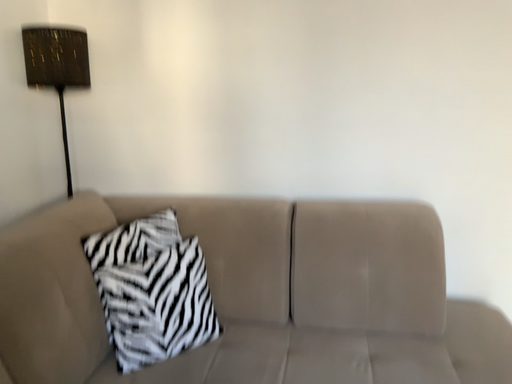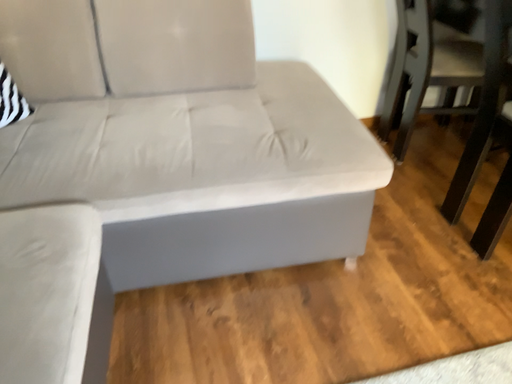
Question: Which way did the camera rotate in the video?

Choices:
 (A) rotated left
 (B) rotated right

Answer: (B)